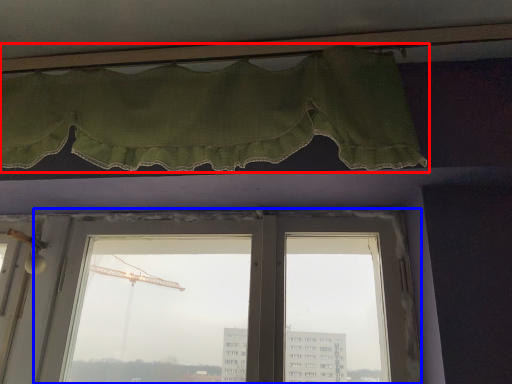
Question: Which object appears farthest to the camera in this image, curtain (highlighted by a red box) or window (highlighted by a blue box)?

Choices:
 (A) curtain
 (B) window

Answer: (B)